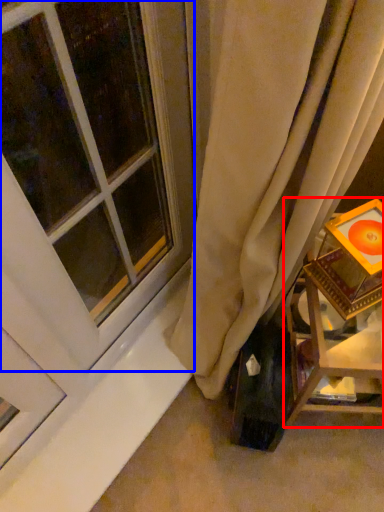
Question: Among these objects, which one is nearest to the camera, furniture (highlighted by a red box) or window (highlighted by a blue box)?

Choices:
 (A) furniture
 (B) window

Answer: (B)